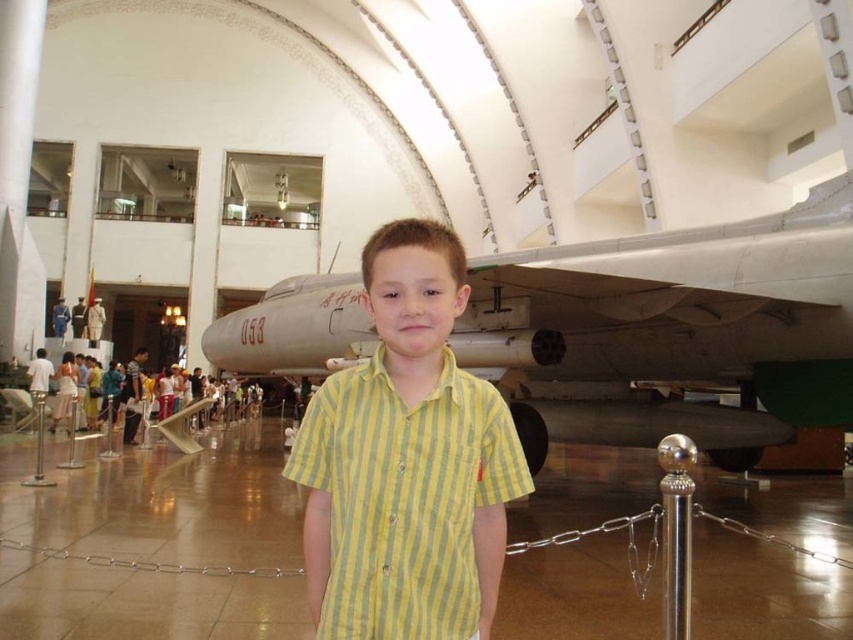
Can you confirm if silver metallic airplane at center is bigger than yellow striped shirt at center?

Correct, silver metallic airplane at center is larger in size than yellow striped shirt at center.

Does silver metallic airplane at center have a lesser width compared to yellow striped shirt at center?

Incorrect, silver metallic airplane at center's width is not less than yellow striped shirt at center's.

Find the location of a particular element. silver metallic airplane at center is located at coordinates (653, 326).